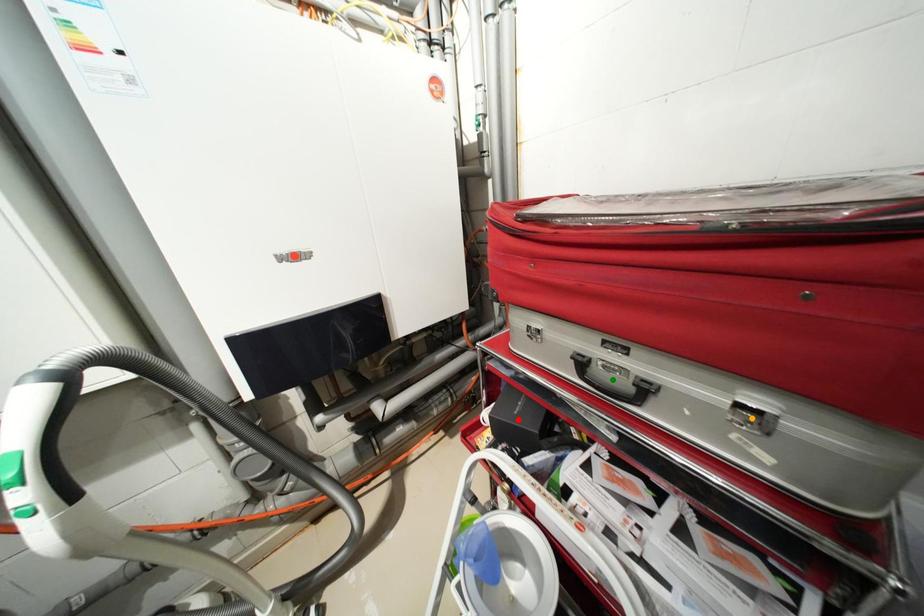
Order these from nearest to farthest:
orange point, green point, red point

orange point → green point → red point